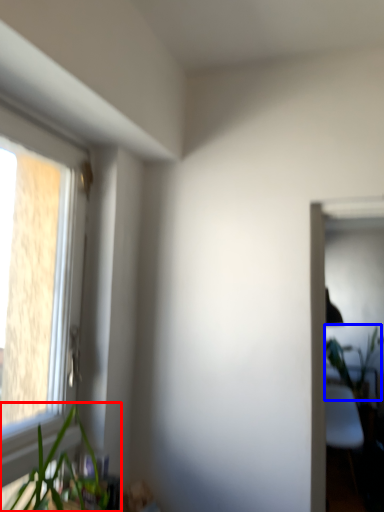
Question: Among these objects, which one is nearest to the camera, houseplant (highlighted by a red box) or vegetation (highlighted by a blue box)?

Choices:
 (A) houseplant
 (B) vegetation

Answer: (A)